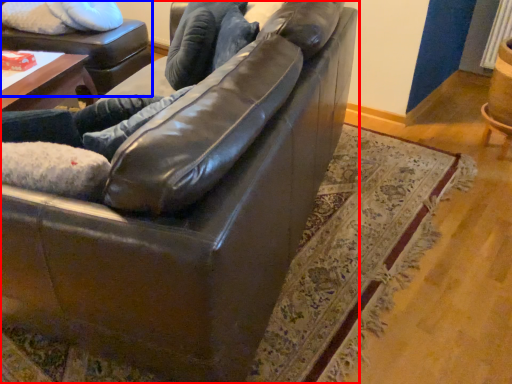
Question: Which object appears closest to the camera in this image, studio couch (highlighted by a red box) or swivel chair (highlighted by a blue box)?

Choices:
 (A) studio couch
 (B) swivel chair

Answer: (A)